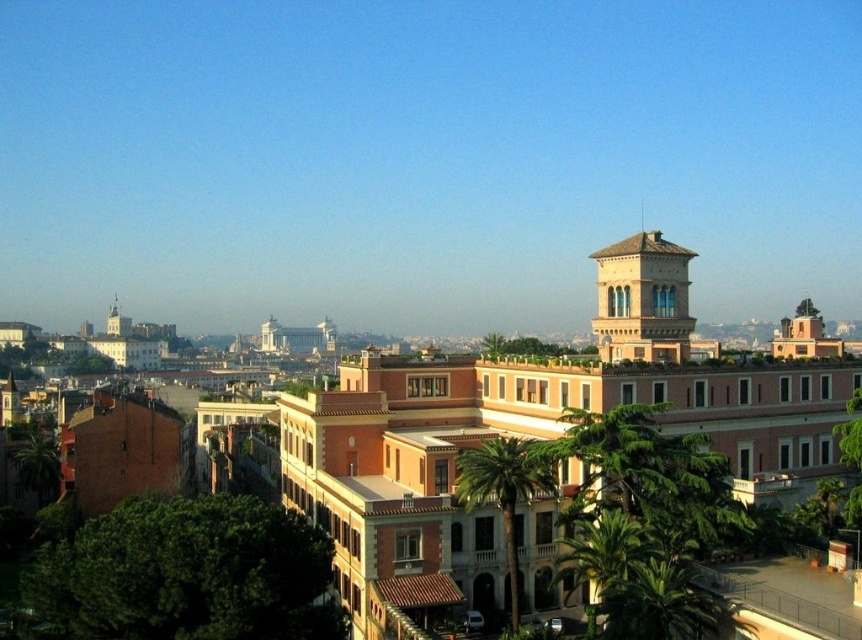
Question: Does beige stone bell tower at upper right have a lesser width compared to green leafy palm tree at center?

Choices:
 (A) yes
 (B) no

Answer: (B)

Question: Which point is closer to the camera taking this photo?

Choices:
 (A) (604, 278)
 (B) (569, 538)

Answer: (B)

Question: Where is beige stone bell tower at upper right located in relation to green leafy palm tree at lower right in the image?

Choices:
 (A) above
 (B) below

Answer: (A)

Question: Is green leafy palm tree at center below green leafy palm tree at lower right?

Choices:
 (A) yes
 (B) no

Answer: (B)

Question: Which object appears farthest from the camera in this image?

Choices:
 (A) green leafy palm tree at center
 (B) beige stone bell tower at upper right
 (C) green leafy palm tree at lower right

Answer: (B)

Question: Which object is the closest to the beige stone bell tower at upper right?

Choices:
 (A) green leafy palm tree at center
 (B) green leafy palm tree at lower right

Answer: (A)